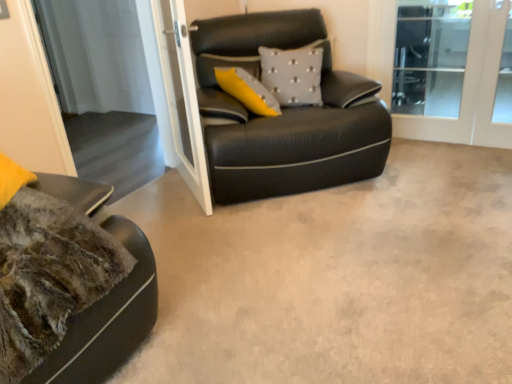
Locate an element on the screen. This screenshot has width=512, height=384. free spot in front of white glass screen door at upper center, the second screen door viewed from the right is located at coordinates (201, 223).